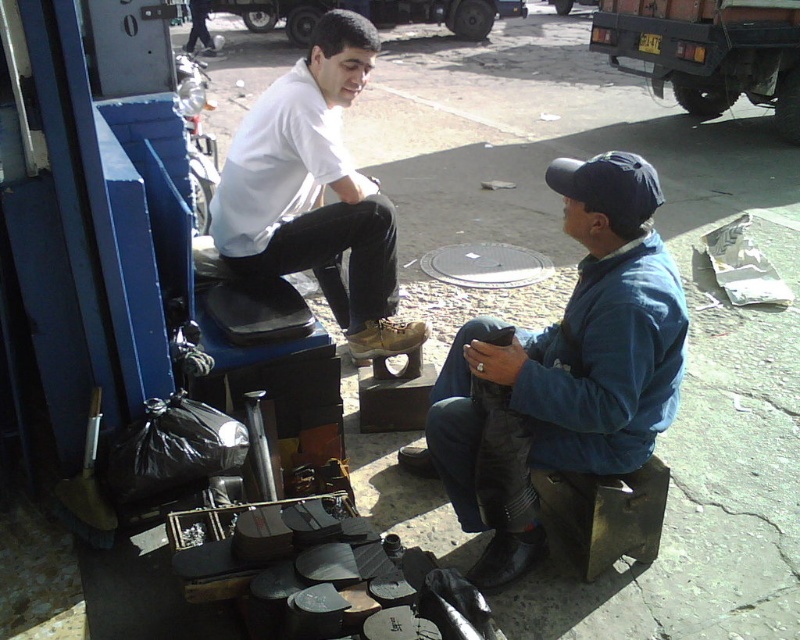
Question: Which object is positioned farthest from the shiny black shoe at center?

Choices:
 (A) brown leather shoe at center
 (B) white matte shoe at center

Answer: (B)

Question: Is blue denim jacket at lower right closer to camera compared to shiny black shoe at center?

Choices:
 (A) no
 (B) yes

Answer: (B)

Question: Which object appears farthest from the camera in this image?

Choices:
 (A) blue denim jacket at lower right
 (B) black leather shoe at lower center
 (C) shiny black shoe at center
 (D) white matte shoe at center

Answer: (C)

Question: Which point is closer to the camera?

Choices:
 (A) (358, 356)
 (B) (410, 442)
 (C) (462, 451)
 (D) (360, 216)

Answer: (C)

Question: Is black leather shoe at lower center smaller than shiny black shoe at center?

Choices:
 (A) no
 (B) yes

Answer: (A)

Question: Observing the image, what is the correct spatial positioning of white matte shoe at center in reference to black leather shoe at lower center?

Choices:
 (A) right
 (B) left

Answer: (B)